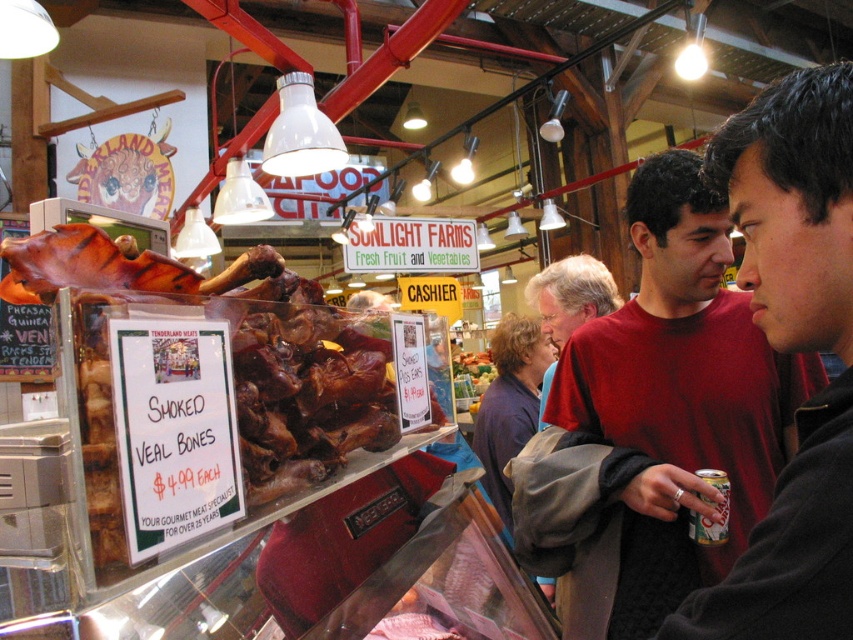
Between red cotton shirt at center and dark blue sweater at center, which one has less height?

Standing shorter between the two is dark blue sweater at center.

Who is more distant from viewer, (x=780, y=374) or (x=502, y=397)?

The point (x=502, y=397) is more distant.

Does point (630, 522) lie behind point (512, 337)?

No, it is in front of (512, 337).

Image resolution: width=853 pixels, height=640 pixels. I want to click on red cotton shirt at center, so click(x=677, y=396).

Does dark blue sweater at center appear on the right side of matte red shirt at center?

In fact, dark blue sweater at center is to the left of matte red shirt at center.

Can you confirm if dark blue sweater at center is shorter than matte red shirt at center?

Incorrect, dark blue sweater at center's height does not fall short of matte red shirt at center's.

At what (x,y) coordinates should I click in order to perform the action: click on dark blue sweater at center. Please return your answer as a coordinate pair (x, y). The height and width of the screenshot is (640, 853). Looking at the image, I should click on (509, 404).

Who is shorter, red cotton shirt at center or matte red shirt at center?

With less height is matte red shirt at center.

Is red cotton shirt at center thinner than matte red shirt at center?

No, red cotton shirt at center is not thinner than matte red shirt at center.

Who is more distant from viewer, (555, 509) or (581, 321)?

The point (581, 321) is behind.

This screenshot has height=640, width=853. Find the location of `red cotton shirt at center`. red cotton shirt at center is located at coordinates (677, 396).